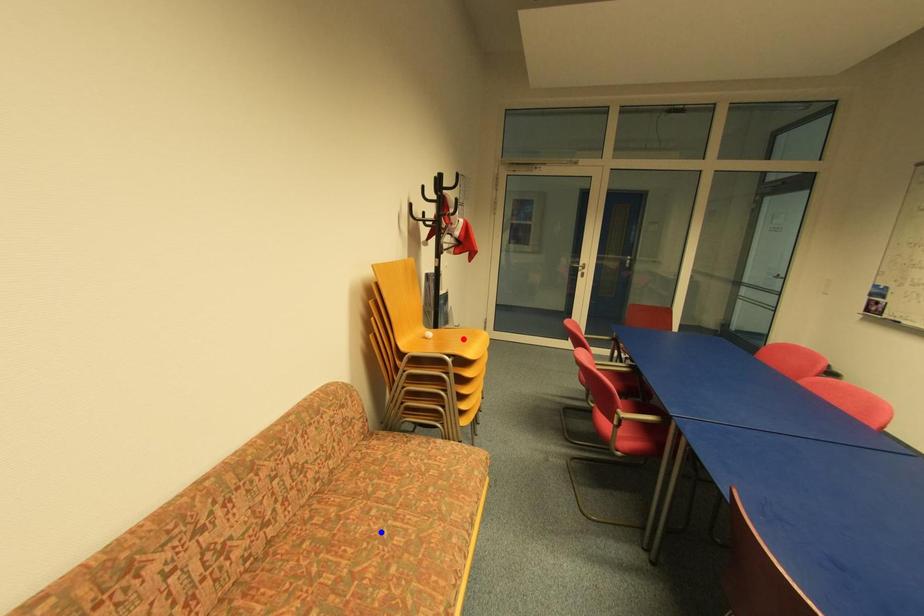
Question: Two points are marked on the image. Which point is closer to the camera?

Choices:
 (A) Blue point is closer.
 (B) Red point is closer.

Answer: (A)